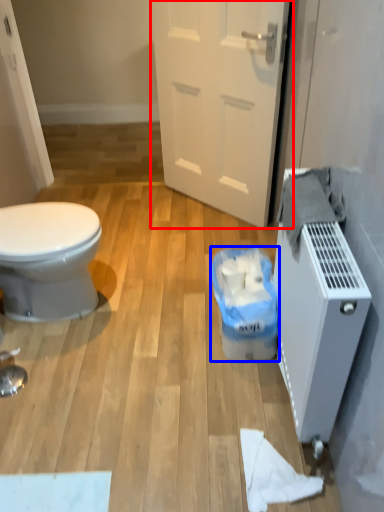
Question: Which object appears closest to the camera in this image, door (highlighted by a red box) or garbage (highlighted by a blue box)?

Choices:
 (A) door
 (B) garbage

Answer: (B)